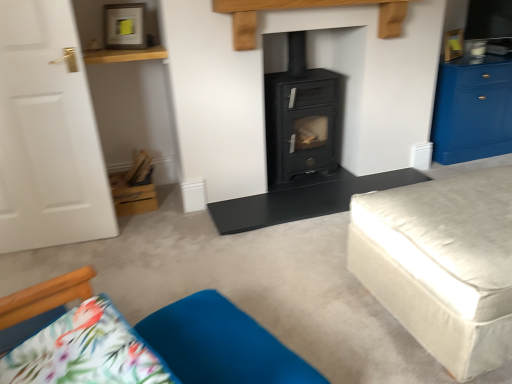
Question: Should I look upward or downward to see velvety blue cushion at lower center?

Choices:
 (A) up
 (B) down

Answer: (B)

Question: Is black matte wood burning stove at center taller than blue glossy cabinet at right?

Choices:
 (A) no
 (B) yes

Answer: (B)

Question: Is black matte wood burning stove at center located outside blue glossy cabinet at right?

Choices:
 (A) no
 (B) yes

Answer: (B)

Question: Is black matte wood burning stove at center thinner than blue glossy cabinet at right?

Choices:
 (A) yes
 (B) no

Answer: (A)

Question: Considering the relative positions of black matte wood burning stove at center and blue glossy cabinet at right in the image provided, is black matte wood burning stove at center to the right of blue glossy cabinet at right from the viewer's perspective?

Choices:
 (A) yes
 (B) no

Answer: (B)

Question: Considering the relative sizes of black matte wood burning stove at center and blue glossy cabinet at right in the image provided, is black matte wood burning stove at center wider than blue glossy cabinet at right?

Choices:
 (A) yes
 (B) no

Answer: (B)

Question: Would you say black matte wood burning stove at center contains blue glossy cabinet at right?

Choices:
 (A) yes
 (B) no

Answer: (B)

Question: Can you confirm if velvety blue cushion at lower center is positioned to the right of black matte table at center?

Choices:
 (A) yes
 (B) no

Answer: (B)

Question: From the image's perspective, is velvety blue cushion at lower center on top of black matte table at center?

Choices:
 (A) no
 (B) yes

Answer: (A)

Question: Considering the relative sizes of velvety blue cushion at lower center and black matte table at center in the image provided, is velvety blue cushion at lower center smaller than black matte table at center?

Choices:
 (A) no
 (B) yes

Answer: (A)

Question: Is velvety blue cushion at lower center turned away from black matte table at center?

Choices:
 (A) yes
 (B) no

Answer: (B)

Question: Does velvety blue cushion at lower center come in front of black matte table at center?

Choices:
 (A) yes
 (B) no

Answer: (A)

Question: Considering the relative positions of velvety blue cushion at lower center and black matte table at center in the image provided, is velvety blue cushion at lower center behind black matte table at center?

Choices:
 (A) no
 (B) yes

Answer: (A)

Question: Considering the relative positions of blue glossy cabinet at right and black matte wood burning stove at center in the image provided, is blue glossy cabinet at right to the right of black matte wood burning stove at center from the viewer's perspective?

Choices:
 (A) yes
 (B) no

Answer: (A)